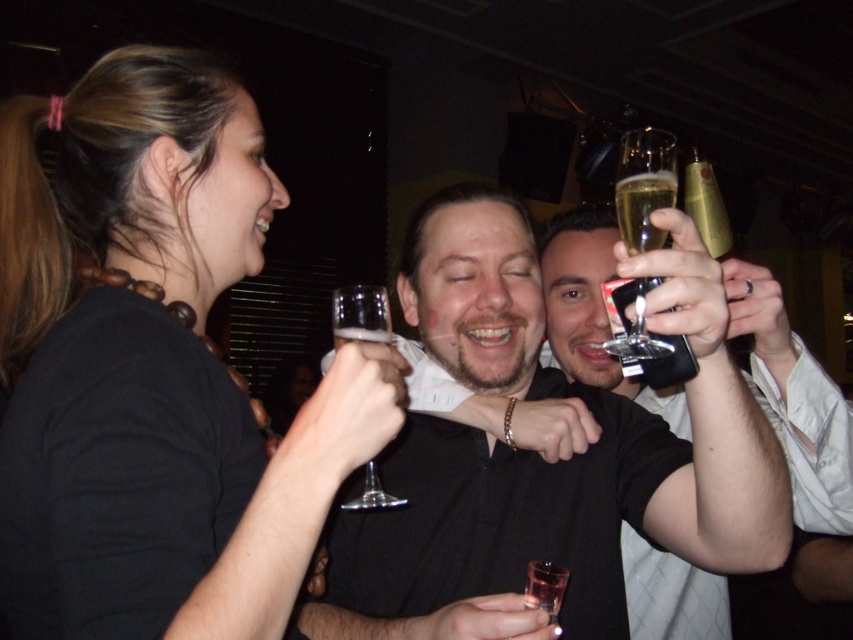
Question: Which object appears closest to the camera in this image?

Choices:
 (A) matte black shirt at upper left
 (B) clear glass champagne flute at upper right
 (C) translucent glass at upper right
 (D) clear glass wine glass at center

Answer: (A)

Question: Which object is closer to the camera taking this photo?

Choices:
 (A) translucent glass at upper right
 (B) shiny black shirt at center
 (C) clear glass champagne flute at upper right

Answer: (B)

Question: Which of the following is the closest to the observer?

Choices:
 (A) clear glass wine glass at center
 (B) shiny black shirt at center
 (C) translucent glass at upper right

Answer: (B)

Question: Does clear glass champagne flute at upper right come behind gold metallic bottle at upper right?

Choices:
 (A) no
 (B) yes

Answer: (A)

Question: Where is matte black shirt at upper left located in relation to shiny black shirt at center in the image?

Choices:
 (A) left
 (B) right

Answer: (A)

Question: Is clear glass wine glass at center above translucent glass at upper right?

Choices:
 (A) no
 (B) yes

Answer: (A)